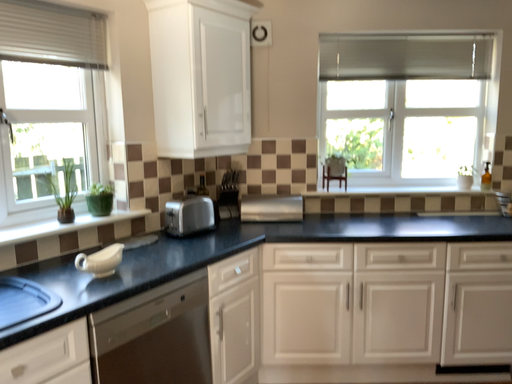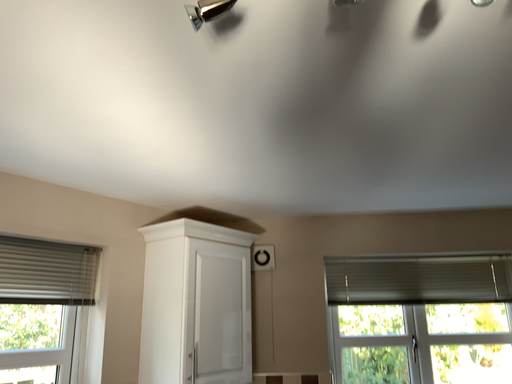
Question: Which way did the camera rotate in the video?

Choices:
 (A) rotated upward
 (B) rotated downward

Answer: (A)